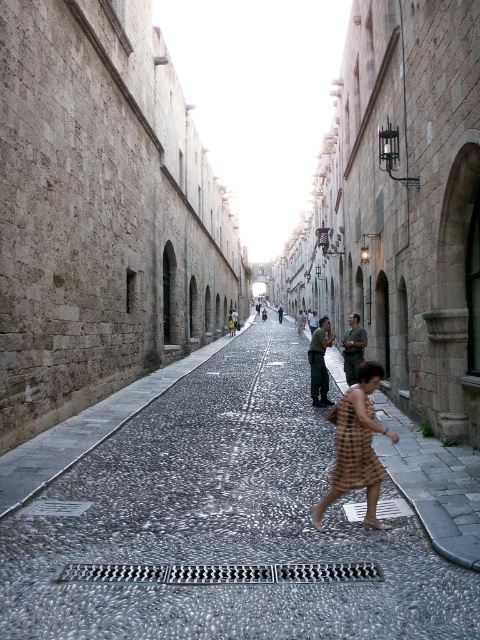
Is the position of gray cobblestone pavement at center less distant than that of brown checkered dress at center?

Yes.

Between point (170, 442) and point (346, 400), which one is positioned behind?

Positioned behind is point (170, 442).

The image size is (480, 640). Find the location of `gray cobblestone pavement at center`. gray cobblestone pavement at center is located at coordinates tap(222, 524).

Which of these two, brown checkered dress at center or brown plaid dress at center, stands shorter?

brown plaid dress at center is shorter.

Does point (368, 365) come closer to viewer compared to point (362, 432)?

That is False.

Where is `brown checkered dress at center`? This screenshot has width=480, height=640. brown checkered dress at center is located at coordinates (357, 445).

Find the location of a particular element. gray cobblestone pavement at center is located at coordinates (222, 524).

Does point (288, 444) come farther from viewer compared to point (362, 426)?

That is True.

Describe the element at coordinates (222, 524) in the screenshot. The height and width of the screenshot is (640, 480). I see `gray cobblestone pavement at center` at that location.

The height and width of the screenshot is (640, 480). Identify the location of gray cobblestone pavement at center. (222, 524).